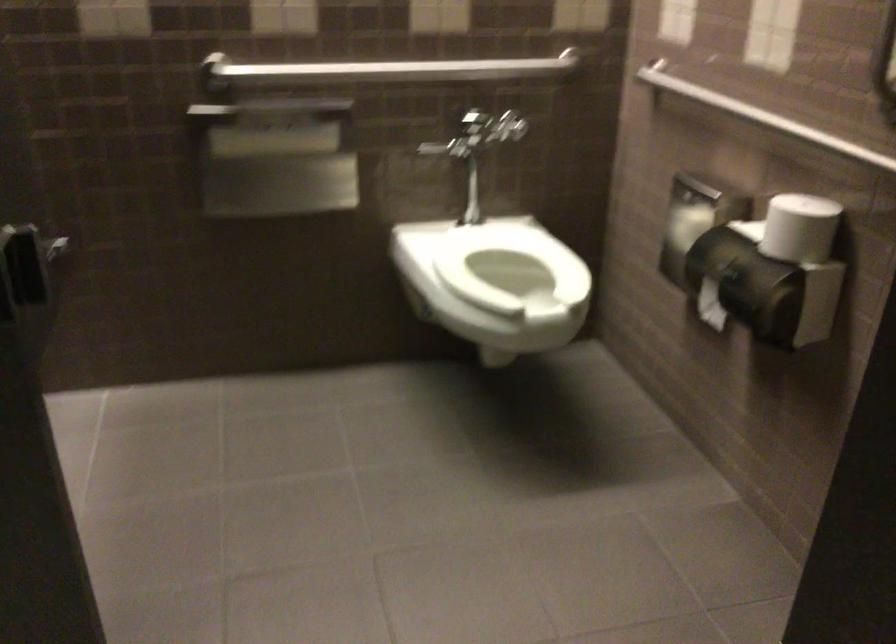
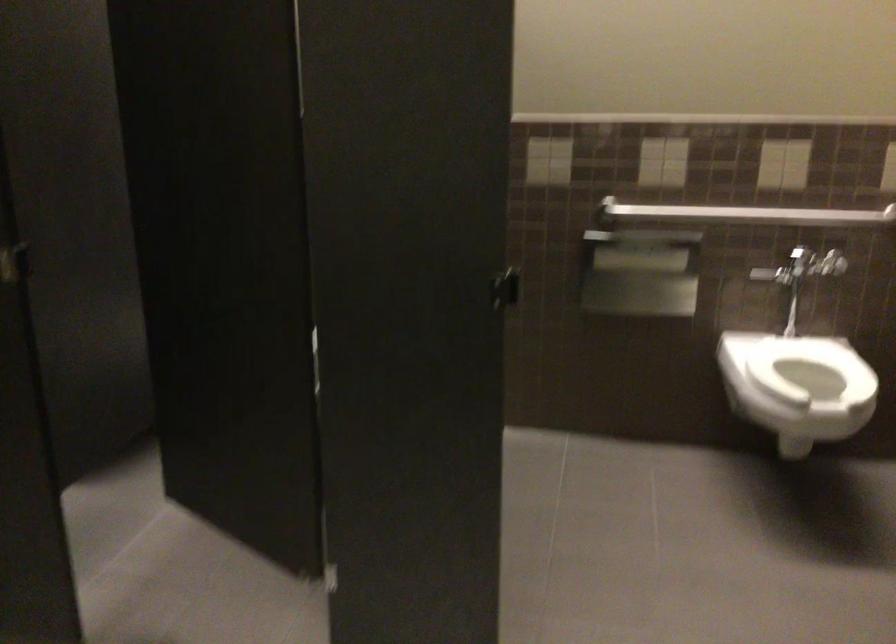
Question: I am providing you with two images of the same scene from different viewpoints. Please identify which objects are invisible in image2.

Choices:
 (A) stall door handle
 (B) blue document feeder
 (C) toilet flush handle
 (D) metal grab bar

Answer: (A)